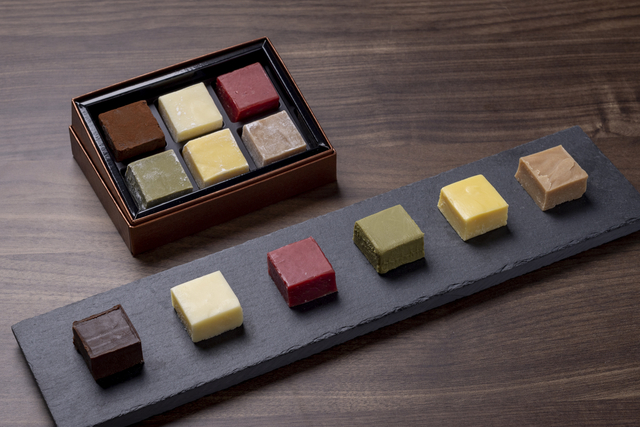
Where is `box`? box is located at coordinates coord(82,135).